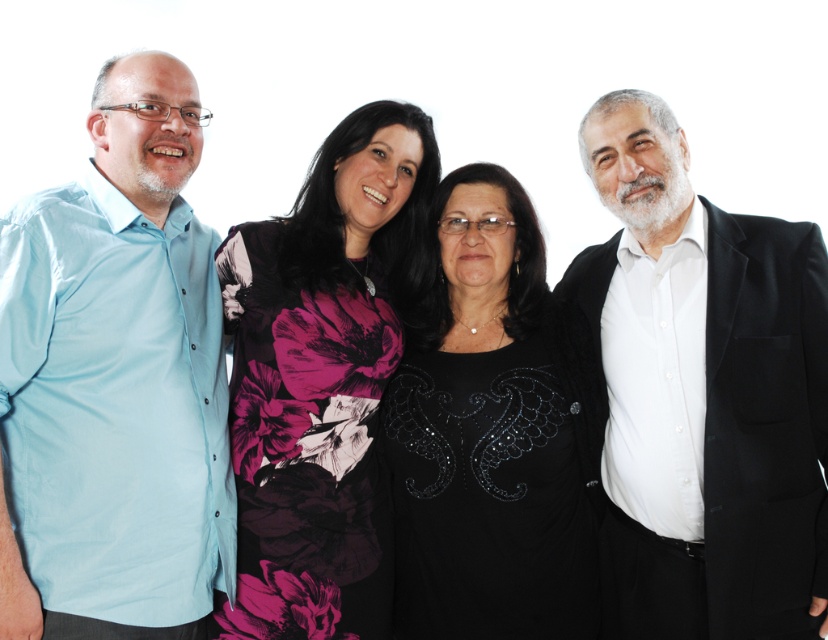
Question: Among these objects, which one is nearest to the camera?

Choices:
 (A) floral-patterned dress at center
 (B) black satin suit at right

Answer: (B)

Question: Which point is farther to the camera?

Choices:
 (A) light blue cotton shirt at left
 (B) black sequined dress at center
 (C) floral-patterned dress at center
 (D) black satin suit at right

Answer: (B)

Question: Does light blue cotton shirt at left have a larger size compared to floral-patterned dress at center?

Choices:
 (A) yes
 (B) no

Answer: (A)

Question: Estimate the real-world distances between objects in this image. Which object is closer to the floral-patterned dress at center?

Choices:
 (A) light blue cotton shirt at left
 (B) black satin suit at right
 (C) black sequined dress at center

Answer: (C)

Question: Can you confirm if light blue cotton shirt at left is thinner than black satin suit at right?

Choices:
 (A) yes
 (B) no

Answer: (A)

Question: Is floral-patterned dress at center smaller than black sequined dress at center?

Choices:
 (A) yes
 (B) no

Answer: (B)